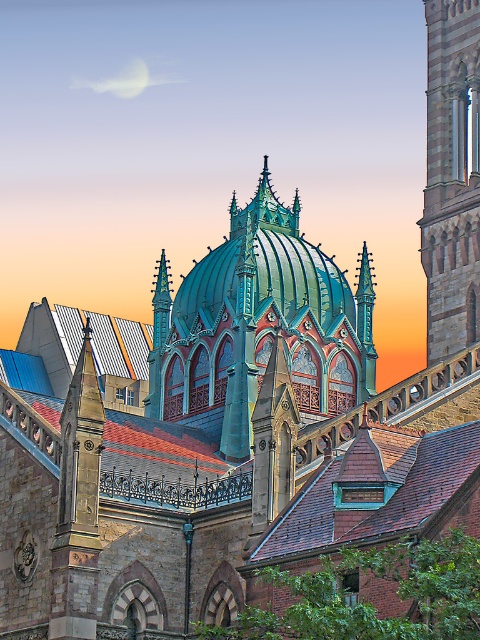
Question: Can you confirm if teal metallic dome at center is thinner than stone tower at right?

Choices:
 (A) no
 (B) yes

Answer: (B)

Question: Which point appears closest to the camera in this image?

Choices:
 (A) (478, 147)
 (B) (226, 406)

Answer: (B)

Question: Is the position of teal metallic dome at center less distant than that of stone tower at right?

Choices:
 (A) yes
 (B) no

Answer: (B)

Question: Which point is farther from the camera taking this photo?

Choices:
 (A) (229, 292)
 (B) (428, 116)

Answer: (B)

Question: Does teal metallic dome at center have a lesser width compared to stone tower at right?

Choices:
 (A) no
 (B) yes

Answer: (B)